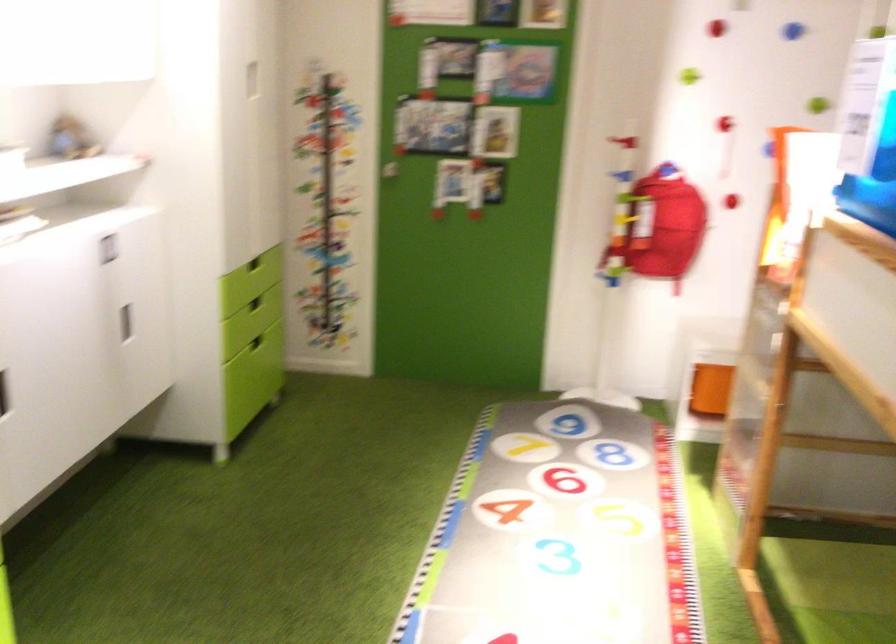
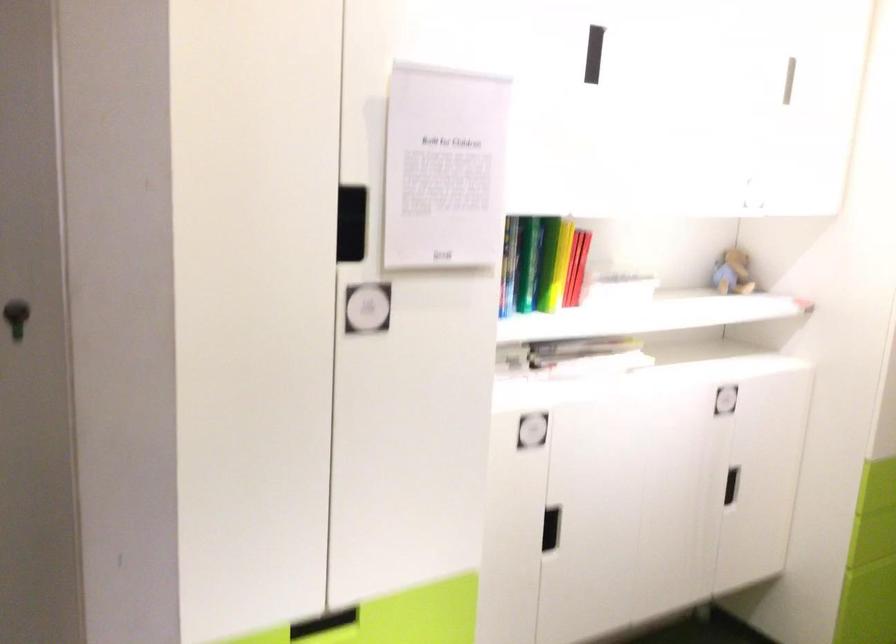
Locate, in the second image, the point that corresponds to [82,138] in the first image.

(733, 272)